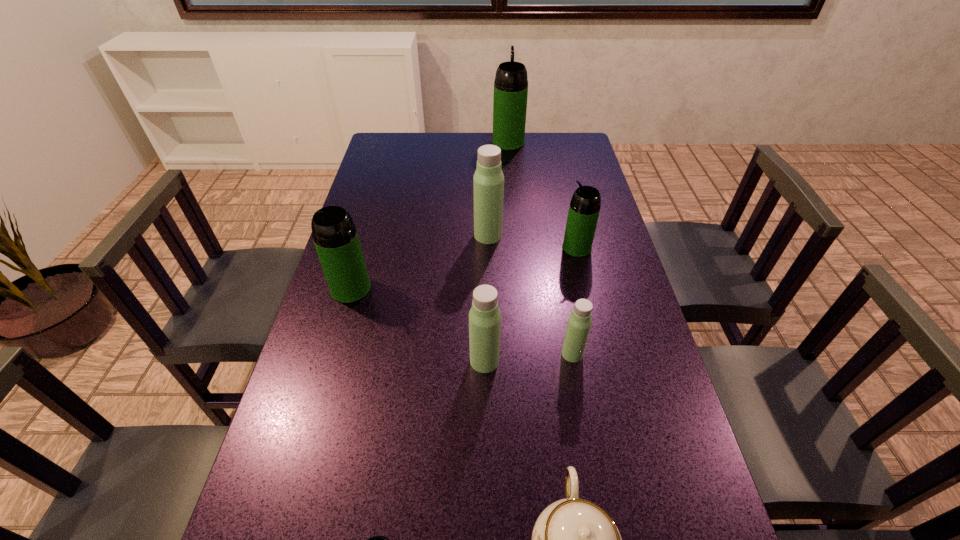
Identify which object is located as the second nearest to the second smallest light thermos bottle. Please provide its 2D coordinates. Your answer should be formatted as a tuple, i.e. [(x, y)], where the tuple contains the x and y coordinates of a point satisfying the conditions above.

[(573, 539)]

Point out which thermos bottle is positioned as the seventh nearest to the shortest object. Please provide its 2D coordinates. Your answer should be formatted as a tuple, i.e. [(x, y)], where the tuple contains the x and y coordinates of a point satisfying the conditions above.

[(511, 82)]

Where is `thermos bottle identified as the closest to the farthest green thermos bottle`? thermos bottle identified as the closest to the farthest green thermos bottle is located at coordinates (488, 182).

Choose which green thermos bottle is the third nearest neighbor to the rightmost green thermos bottle. Please provide its 2D coordinates. Your answer should be formatted as a tuple, i.e. [(x, y)], where the tuple contains the x and y coordinates of a point satisfying the conditions above.

[(375, 539)]

This screenshot has height=540, width=960. What are the coordinates of `the closest green thermos bottle to the second biggest light thermos bottle` in the screenshot? It's located at (335, 236).

Locate an element on the screen. light thermos bottle that is the second closest to the second thermos bottle from right to left is located at coordinates (488, 182).

The width and height of the screenshot is (960, 540). I want to click on light thermos bottle that stands as the closest to the biggest light thermos bottle, so click(484, 316).

Locate an element on the screen. The image size is (960, 540). vacant area in the image that satisfies the following two spatial constraints: 1. from the spout of the rightmost thermos bottle; 2. on the front side of the sixth thermos bottle from left to right is located at coordinates (602, 354).

What are the coordinates of `vacant area in the image that satisfies the following two spatial constraints: 1. on the front side of the smallest light thermos bottle; 2. on the left side of the biggest light thermos bottle` in the screenshot? It's located at (491, 354).